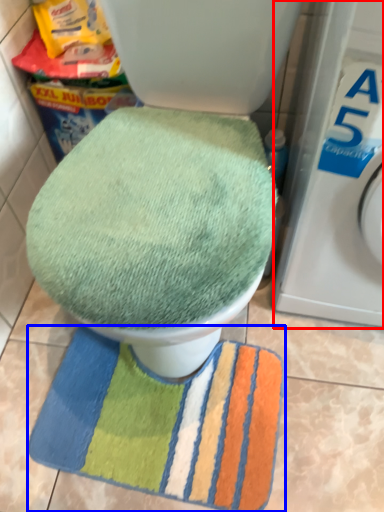
Question: Which point is further to the camera, washing machine (highlighted by a red box) or beach towel (highlighted by a blue box)?

Choices:
 (A) washing machine
 (B) beach towel

Answer: (B)